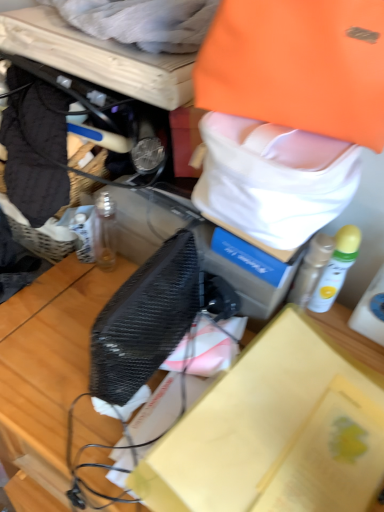
The height and width of the screenshot is (512, 384). In order to click on free region under white cotton towel at upper center, placed as the second clothing when sorted from right to left (from a real-world perspective) in this screenshot , I will do `click(70, 30)`.